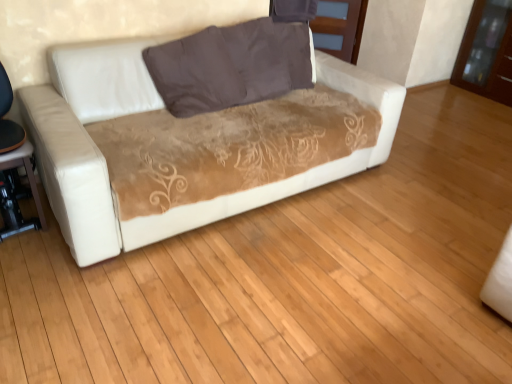
Question: Considering the relative positions of matte brown wood dresser at upper center, acting as the second dresser starting from the right, and brown fabric pillow at center in the image provided, is matte brown wood dresser at upper center, acting as the second dresser starting from the right, in front of brown fabric pillow at center?

Choices:
 (A) yes
 (B) no

Answer: (B)

Question: Is matte brown wood dresser at upper center, acting as the second dresser starting from the right, oriented away from brown fabric pillow at center?

Choices:
 (A) no
 (B) yes

Answer: (A)

Question: Does matte brown wood dresser at upper center, acting as the second dresser starting from the right, have a lesser height compared to brown fabric pillow at center?

Choices:
 (A) no
 (B) yes

Answer: (A)

Question: From a real-world perspective, is matte brown wood dresser at upper center, acting as the second dresser starting from the right, on brown fabric pillow at center?

Choices:
 (A) yes
 (B) no

Answer: (B)

Question: Can brown fabric pillow at center be found inside matte brown wood dresser at upper center, acting as the second dresser starting from the right?

Choices:
 (A) yes
 (B) no

Answer: (B)

Question: In the image, is matte brown wood dresser at upper center, placed as the first dresser when sorted from left to right, positioned in front of or behind brown glossy dresser at upper right, acting as the first dresser starting from the right?

Choices:
 (A) front
 (B) behind

Answer: (B)

Question: Is matte brown wood dresser at upper center, acting as the second dresser starting from the right, inside or outside of brown glossy dresser at upper right, the second dresser viewed from the left?

Choices:
 (A) outside
 (B) inside

Answer: (A)

Question: Based on their positions, is matte brown wood dresser at upper center, placed as the first dresser when sorted from left to right, located to the left or right of brown glossy dresser at upper right, acting as the first dresser starting from the right?

Choices:
 (A) right
 (B) left

Answer: (B)

Question: In terms of size, does matte brown wood dresser at upper center, placed as the first dresser when sorted from left to right, appear bigger or smaller than brown glossy dresser at upper right, the second dresser viewed from the left?

Choices:
 (A) small
 (B) big

Answer: (A)

Question: From the image's perspective, relative to brown fabric pillow at center, is brown glossy dresser at upper right, the second dresser viewed from the left, above or below?

Choices:
 (A) below
 (B) above

Answer: (B)

Question: From a real-world perspective, relative to brown fabric pillow at center, is brown glossy dresser at upper right, the second dresser viewed from the left, vertically above or below?

Choices:
 (A) below
 (B) above

Answer: (A)

Question: In terms of width, does brown glossy dresser at upper right, acting as the first dresser starting from the right, look wider or thinner when compared to brown fabric pillow at center?

Choices:
 (A) wide
 (B) thin

Answer: (A)

Question: In the image, is brown glossy dresser at upper right, acting as the first dresser starting from the right, on the left side or the right side of brown fabric pillow at center?

Choices:
 (A) left
 (B) right

Answer: (B)

Question: Is matte black table at lower left wider or thinner than brown fabric pillow at center?

Choices:
 (A) wide
 (B) thin

Answer: (A)

Question: From the image's perspective, is matte black table at lower left located above or below brown fabric pillow at center?

Choices:
 (A) above
 (B) below

Answer: (B)